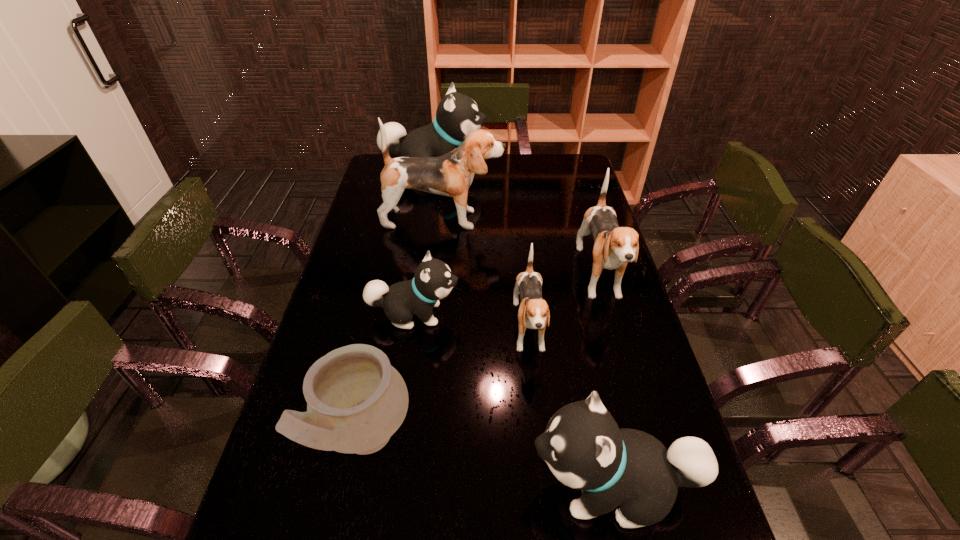
What are the coordinates of `vacant area that lies between the second brown puppy from right to left and the second smallest brown puppy` in the screenshot? It's located at (564, 305).

Where is `free spot between the sixth nearest object and the second smallest brown puppy`? free spot between the sixth nearest object and the second smallest brown puppy is located at coordinates (521, 248).

Identify the location of object that stands as the second closest to the smallest white puppy. (356, 400).

You are a GUI agent. You are given a task and a screenshot of the screen. Output one action in this format:
    pyautogui.click(x=<x>, y=<y>)
    Task: Click on the object that is the third closest to the second nearest white puppy
    The width and height of the screenshot is (960, 540).
    Given the screenshot: What is the action you would take?
    pyautogui.click(x=451, y=175)

Locate an element on the screen. the closest puppy to the biggest brown puppy is located at coordinates (457, 115).

You are a GUI agent. You are given a task and a screenshot of the screen. Output one action in this format:
    pyautogui.click(x=<x>, y=<y>)
    Task: Click on the puppy that can be found as the third closest to the farthest object
    
    Given the screenshot: What is the action you would take?
    pyautogui.click(x=433, y=280)

The width and height of the screenshot is (960, 540). I want to click on brown puppy that is the second closest to the rightmost brown puppy, so click(451, 175).

Where is `brown puppy identified as the closest to the smallest brown puppy`? The image size is (960, 540). brown puppy identified as the closest to the smallest brown puppy is located at coordinates (614, 246).

Identify the location of white puppy that is the third closest one to the brown pottery. The image size is (960, 540). (457, 115).

Find the location of a particular element. the second closest white puppy to the farthest white puppy is located at coordinates (584, 448).